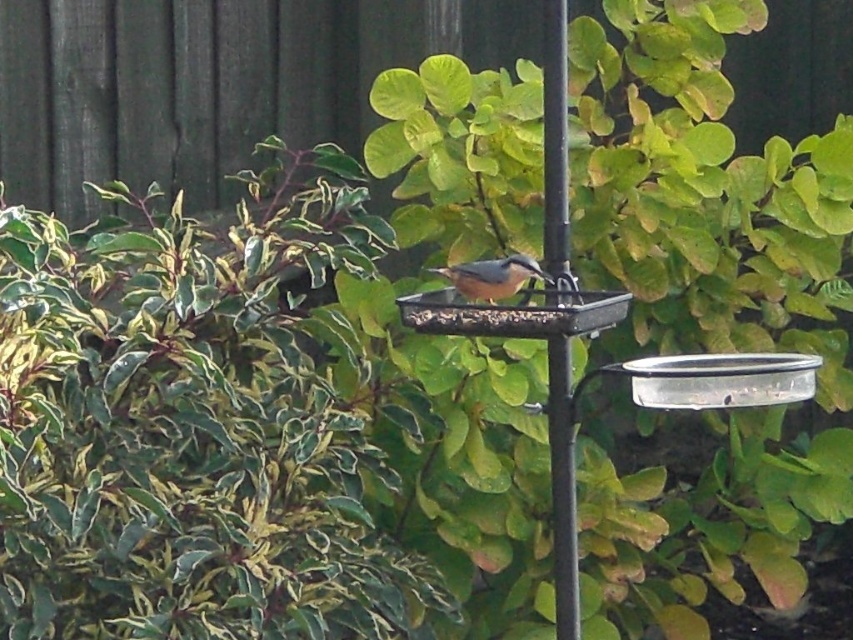
Who is positioned more to the right, green leafy bush at center or black metal pole at center?

green leafy bush at center

Can you confirm if green leafy bush at center is bigger than black metal pole at center?

Correct, green leafy bush at center is larger in size than black metal pole at center.

Which is behind, point (781, 273) or point (548, 180)?

Positioned behind is point (781, 273).

What are the coordinates of `green leafy bush at center` in the screenshot? It's located at (701, 193).

Between green leafy bush at center and brown matte bird at center, which one appears on the left side from the viewer's perspective?

brown matte bird at center is more to the left.

Does point (619, 163) come farther from viewer compared to point (480, 292)?

That is True.

What do you see at coordinates (701, 193) in the screenshot? Image resolution: width=853 pixels, height=640 pixels. I see `green leafy bush at center` at bounding box center [701, 193].

You are a GUI agent. You are given a task and a screenshot of the screen. Output one action in this format:
    pyautogui.click(x=<x>, y=<y>)
    Task: Click on the green leafy bush at center
    This screenshot has width=853, height=640.
    Given the screenshot: What is the action you would take?
    pyautogui.click(x=701, y=193)

Between black metal pole at center and brown matte bird at center, which one has more height?

Standing taller between the two is black metal pole at center.

Describe the element at coordinates (556, 156) in the screenshot. This screenshot has width=853, height=640. I see `black metal pole at center` at that location.

Where is `black metal pole at center`? Image resolution: width=853 pixels, height=640 pixels. black metal pole at center is located at coordinates (556, 156).